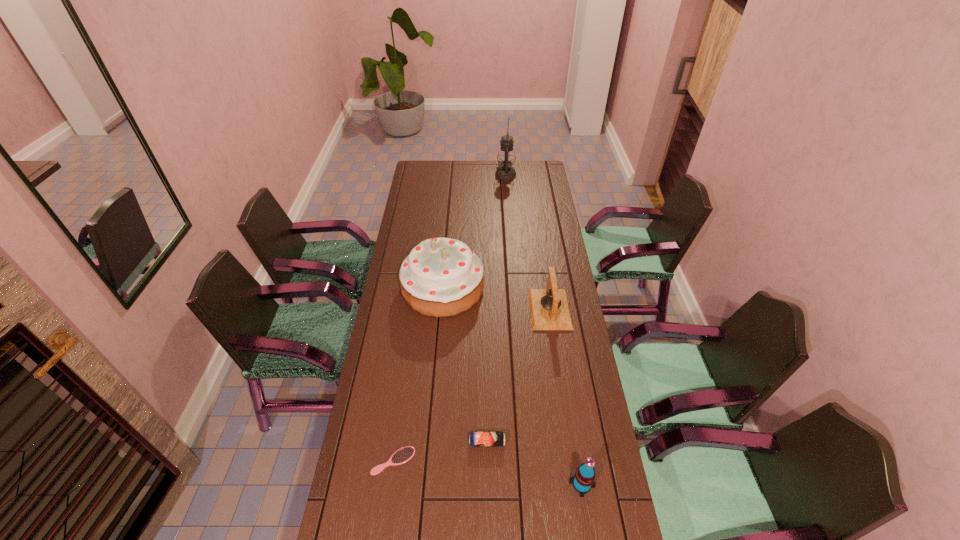
The height and width of the screenshot is (540, 960). In the image, there is a desktop. Find the location of `free space at the right edge`. free space at the right edge is located at coordinates (549, 218).

Identify the location of vacant point located between the farthest object and the second shortest object. (496, 309).

Identify the location of unoccupied position between the second tallest object and the farthest object. The image size is (960, 540). (474, 231).

Locate an element on the screen. The image size is (960, 540). empty space between the shortest object and the farthest object is located at coordinates (449, 318).

Find the location of a particular element. free point between the beer can and the soda is located at coordinates (535, 463).

You are a GUI agent. You are given a task and a screenshot of the screen. Output one action in this format:
    pyautogui.click(x=<x>, y=<y>)
    Task: Click on the free space between the cake and the bell
    The width and height of the screenshot is (960, 540).
    Given the screenshot: What is the action you would take?
    pyautogui.click(x=496, y=299)

Identify the location of vacant space that's between the fifth tallest object and the hairbrush. (441, 451).

You are a GUI agent. You are given a task and a screenshot of the screen. Output one action in this format:
    pyautogui.click(x=<x>, y=<y>)
    Task: Click on the free space between the cake and the tallest object
    
    Given the screenshot: What is the action you would take?
    pyautogui.click(x=474, y=231)

The height and width of the screenshot is (540, 960). In order to click on vacant area that lies between the beer can and the bell in this screenshot , I will do [x=518, y=376].

Locate an element on the screen. This screenshot has height=540, width=960. unoccupied area between the oil lamp and the beer can is located at coordinates (496, 309).